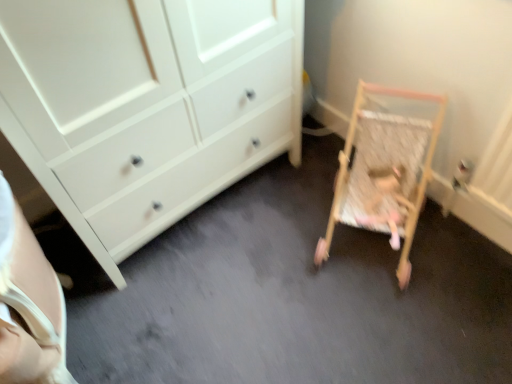
This screenshot has height=384, width=512. I want to click on free space to the left of wooden baby cot at lower right, so click(271, 246).